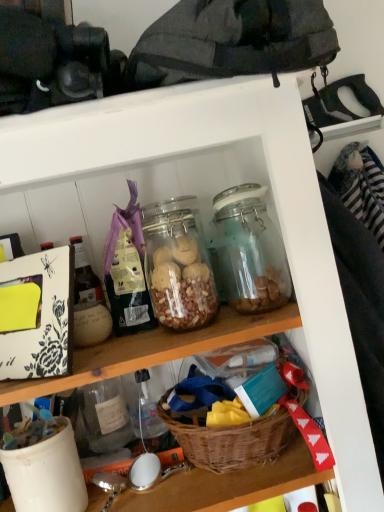
The width and height of the screenshot is (384, 512). In order to click on empty space that is ontop of woven brown basket at lower center in this screenshot , I will do `click(236, 380)`.